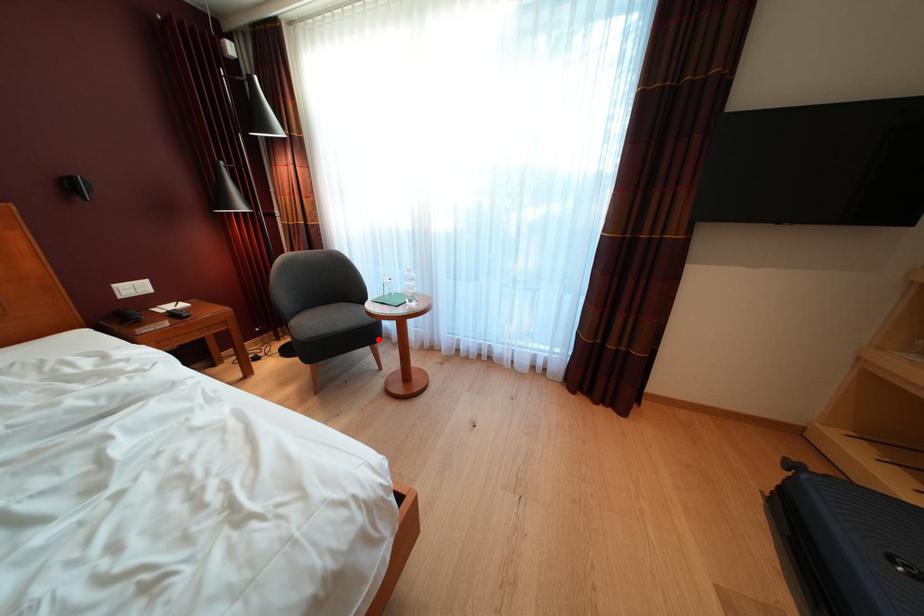
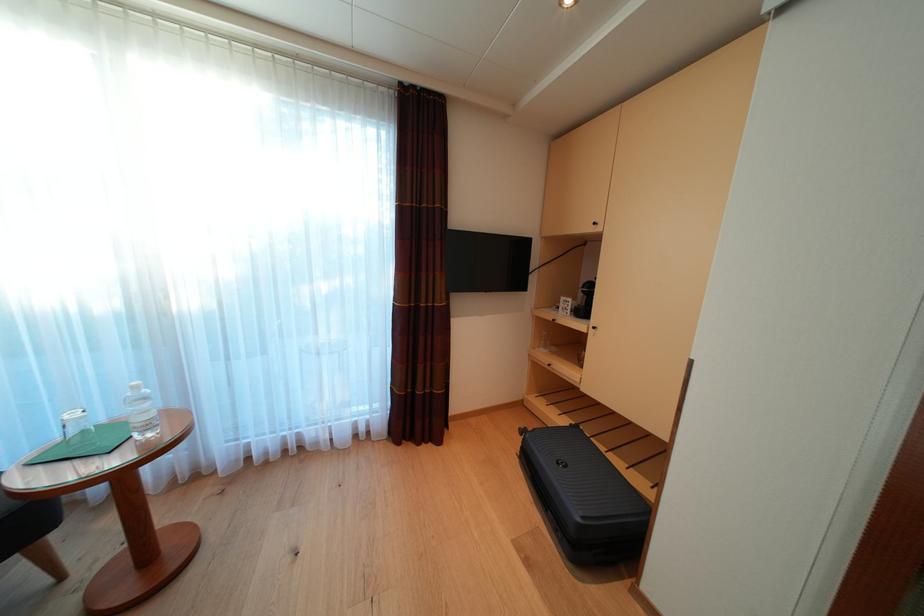
Question: A red point is marked in image1. In image2, is the corresponding 3D point closer to the camera or farther? Reply with the corresponding letter.

Choices:
 (A) The corresponding 3D point is closer.
 (B) The corresponding 3D point is farther.

Answer: (A)